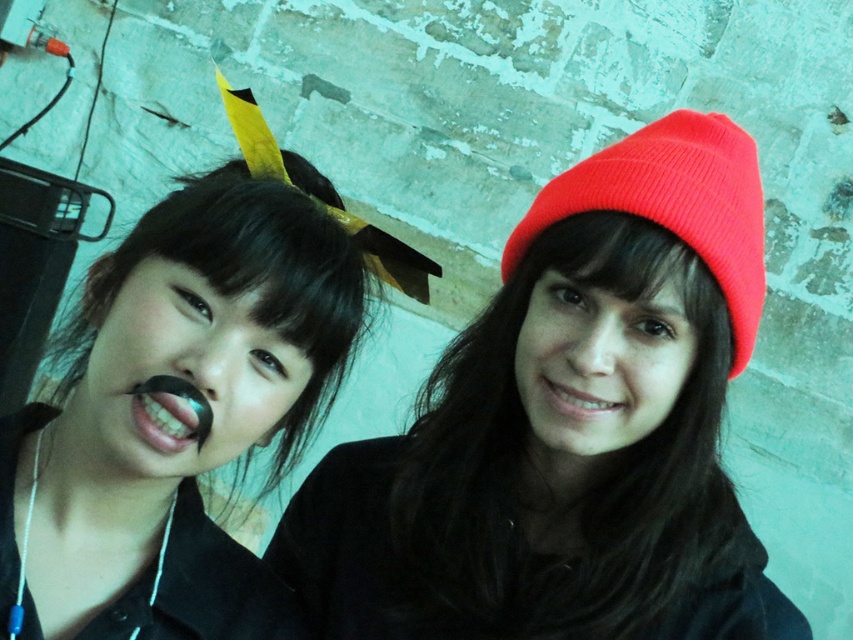
Question: Among these objects, which one is farthest from the camera?

Choices:
 (A) teethsmoothmouth at left
 (B) white glossy teeth at center
 (C) red knit beanie at right
 (D) black matte hairpin at upper left

Answer: (B)

Question: Which of these objects is positioned farthest from the teethsmoothmouth at left?

Choices:
 (A) matte red beanie at center
 (B) black matte lips at left

Answer: (A)

Question: Is black matte lips at left bigger than red knit beanie at right?

Choices:
 (A) no
 (B) yes

Answer: (A)

Question: Does black matte lips at left have a lesser width compared to black matte nose at center?

Choices:
 (A) yes
 (B) no

Answer: (B)

Question: Which of these objects is positioned closest to the matte red beanie at center?

Choices:
 (A) black matte nose at center
 (B) black matte lips at left
 (C) black matte hairpin at upper left
 (D) teethsmoothmouth at left

Answer: (B)

Question: Where is red knit beanie at right located in relation to teethsmoothmouth at left in the image?

Choices:
 (A) left
 (B) right

Answer: (B)